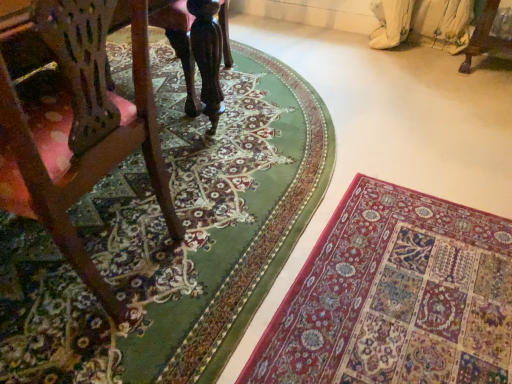
Question: Is rich red carpet at lower right, positioned as the first mat in right-to-left order, bigger or smaller than wooden chair at left?

Choices:
 (A) small
 (B) big

Answer: (A)

Question: From a real-world perspective, is rich red carpet at lower right, positioned as the first mat in right-to-left order, above or below wooden chair at left?

Choices:
 (A) below
 (B) above

Answer: (A)

Question: Estimate the real-world distances between objects in this image. Which object is closer to the carpeted floor at lower right, the 1th mat when ordered from left to right?

Choices:
 (A) wooden chair at left
 (B) rich red carpet at lower right, the 2th mat in the left-to-right sequence

Answer: (B)

Question: Which object is positioned farthest from the wooden chair at left?

Choices:
 (A) rich red carpet at lower right, positioned as the first mat in right-to-left order
 (B) carpeted floor at lower right, the second mat when ordered from right to left

Answer: (A)